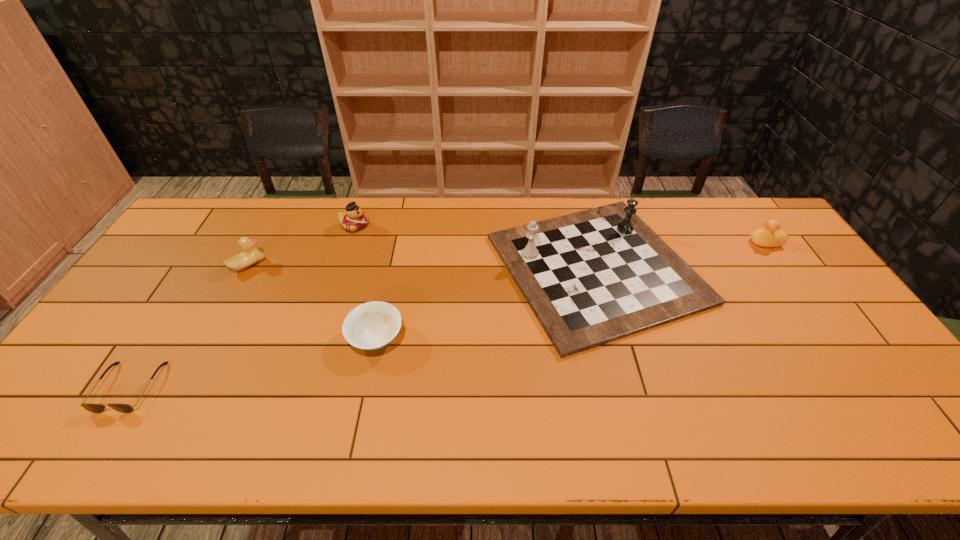
Where is `gameboard`? The image size is (960, 540). gameboard is located at coordinates (592, 277).

Where is `the tallest object`? The width and height of the screenshot is (960, 540). the tallest object is located at coordinates (592, 277).

Identify the location of the second duck from right to left. The width and height of the screenshot is (960, 540). (354, 219).

Where is `the fourth object from right to left`? Image resolution: width=960 pixels, height=540 pixels. the fourth object from right to left is located at coordinates (354, 219).

Where is `the leftmost duck`? The width and height of the screenshot is (960, 540). the leftmost duck is located at coordinates (250, 255).

This screenshot has height=540, width=960. In order to click on the second object from left to right in this screenshot , I will do `click(250, 255)`.

Where is `the rightmost object`? the rightmost object is located at coordinates (765, 237).

Image resolution: width=960 pixels, height=540 pixels. In order to click on the second nearest duck in this screenshot , I will do `click(765, 237)`.

Find the location of `bowl`. bowl is located at coordinates (370, 326).

Where is `the fourth object from left to right`? the fourth object from left to right is located at coordinates (370, 326).